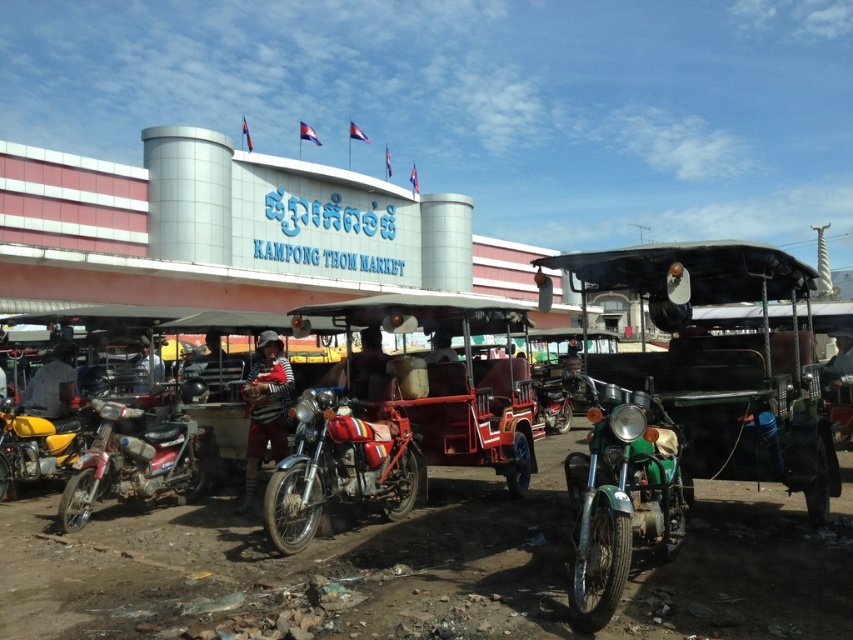
Question: Is yellow matte motorcycle at lower left behind striped fabric shirt at center?

Choices:
 (A) no
 (B) yes

Answer: (A)

Question: In this image, where is dark gray shirt at left located relative to light blue striped shirt at center?

Choices:
 (A) above
 (B) below

Answer: (B)

Question: In this image, where is green matte motorcycle at lower right located relative to light blue striped shirt at center?

Choices:
 (A) left
 (B) right

Answer: (B)

Question: Which point is farther from the camera taking this photo?

Choices:
 (A) (144, 372)
 (B) (24, 403)
 (C) (363, 403)

Answer: (A)

Question: Based on their relative distances, which object is nearer to the shiny red motorcycle at left?

Choices:
 (A) green matte motorcycle at lower right
 (B) dark gray shirt at left

Answer: (B)

Question: Which point is farther to the camera?

Choices:
 (A) (32, 392)
 (B) (448, 355)

Answer: (A)